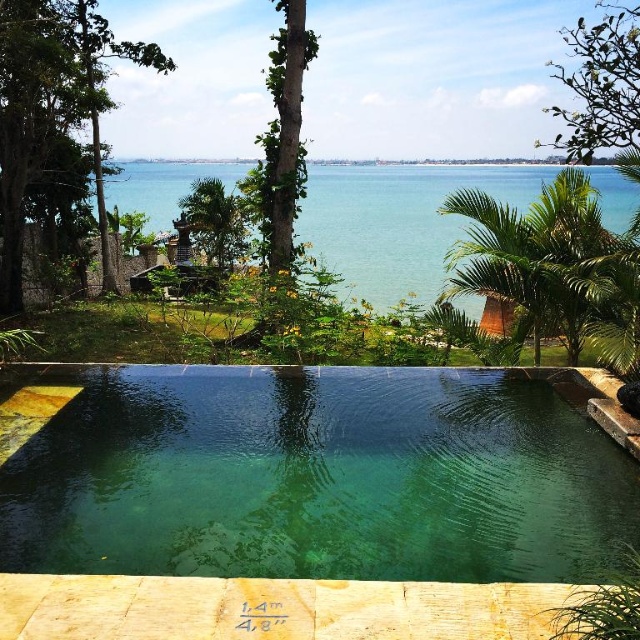
Question: Can you confirm if clear blue water at center is positioned below green leafy palm tree at center?

Choices:
 (A) yes
 (B) no

Answer: (B)

Question: Is clear blue water at center thinner than green leafy palm tree at center?

Choices:
 (A) yes
 (B) no

Answer: (B)

Question: Which point is farther to the camera?

Choices:
 (A) (228, 564)
 (B) (579, 196)

Answer: (B)

Question: Which point appears farthest from the camera in this image?

Choices:
 (A) (177, 186)
 (B) (612, 252)
 (C) (285, 500)
 (D) (216, 196)

Answer: (A)

Question: Which point is closer to the camera taking this photo?

Choices:
 (A) (547, 324)
 (B) (225, 256)
 (C) (225, 188)

Answer: (A)

Question: Is green leafy palm tree at right to the left of green leafy palm tree at center from the viewer's perspective?

Choices:
 (A) yes
 (B) no

Answer: (B)